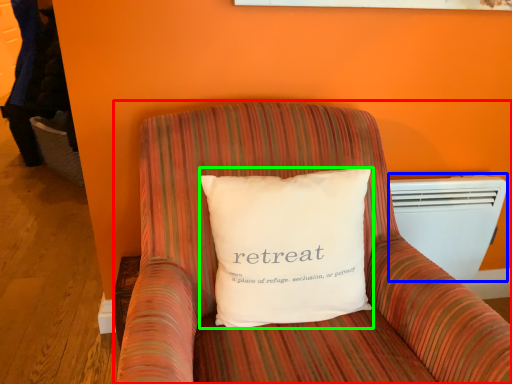
Question: Which object is positioned closest to furniture (highlighted by a red box)? Select from air conditioning (highlighted by a blue box) and pillow (highlighted by a green box).

Choices:
 (A) air conditioning
 (B) pillow

Answer: (B)